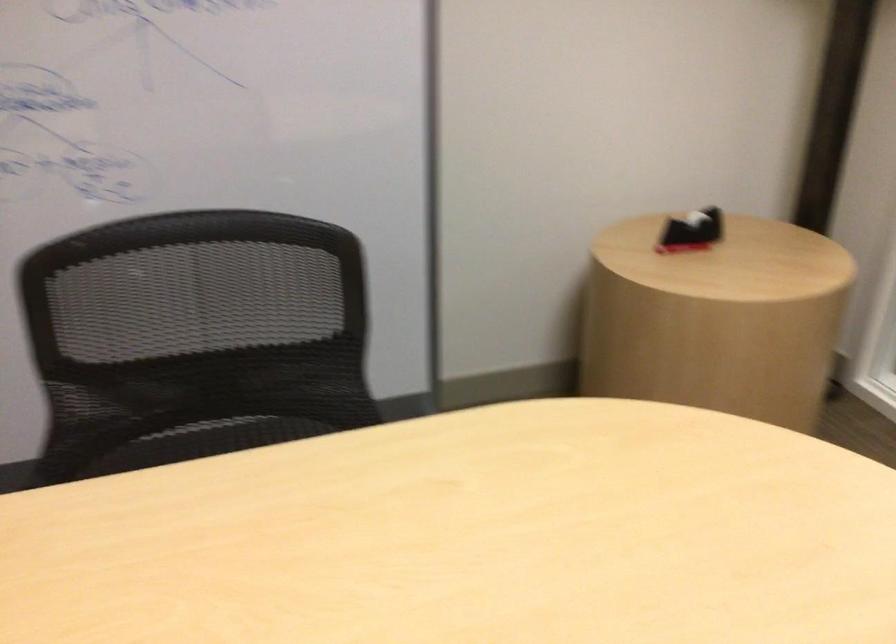
Where would you sit the chair sitting surface? Please return your answer as a coordinate pair (x, y).

(218, 438)